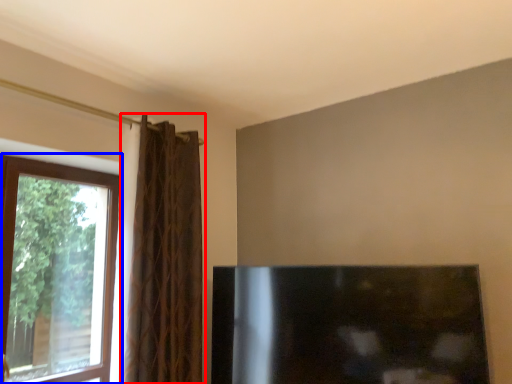
Question: Which object is closer to the camera taking this photo, curtain (highlighted by a red box) or window (highlighted by a blue box)?

Choices:
 (A) curtain
 (B) window

Answer: (B)